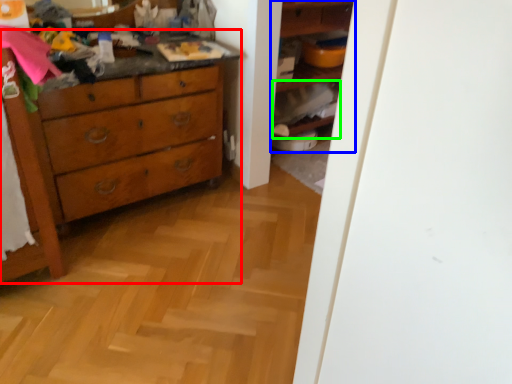
Question: Based on their relative distances, which object is farther from chest of drawers (highlighted by a red box)? Choose from shelf (highlighted by a blue box) and cabinet (highlighted by a green box).

Choices:
 (A) shelf
 (B) cabinet

Answer: (A)